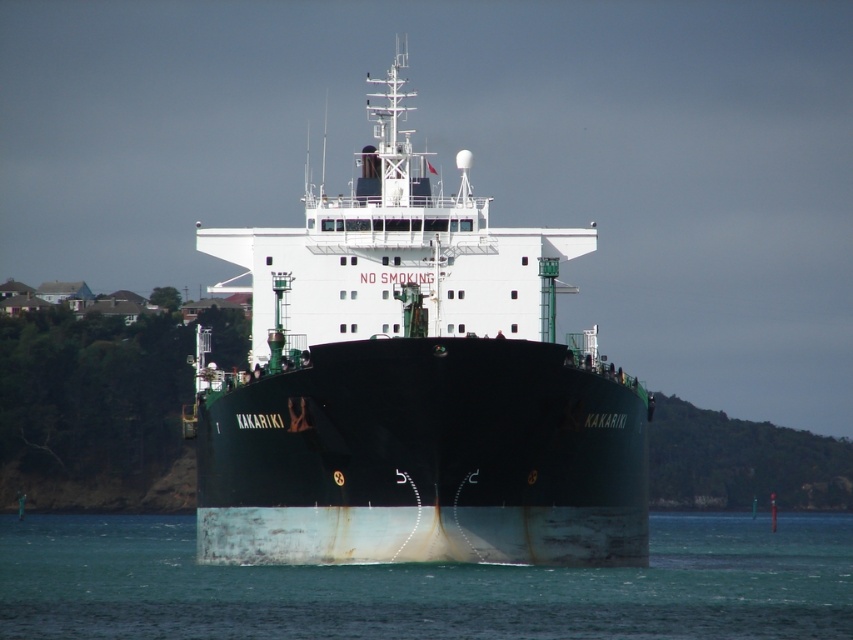
Question: Which of the following is the closest to the observer?

Choices:
 (A) (718, 627)
 (B) (596, 540)

Answer: (A)

Question: Is green matte ship at center further to the viewer compared to smooth teal water at center?

Choices:
 (A) yes
 (B) no

Answer: (A)

Question: Is green matte ship at center above smooth teal water at center?

Choices:
 (A) no
 (B) yes

Answer: (B)

Question: Can you confirm if green matte ship at center is positioned below smooth teal water at center?

Choices:
 (A) no
 (B) yes

Answer: (A)

Question: Which point is farther to the camera?

Choices:
 (A) (469, 576)
 (B) (242, 262)

Answer: (B)